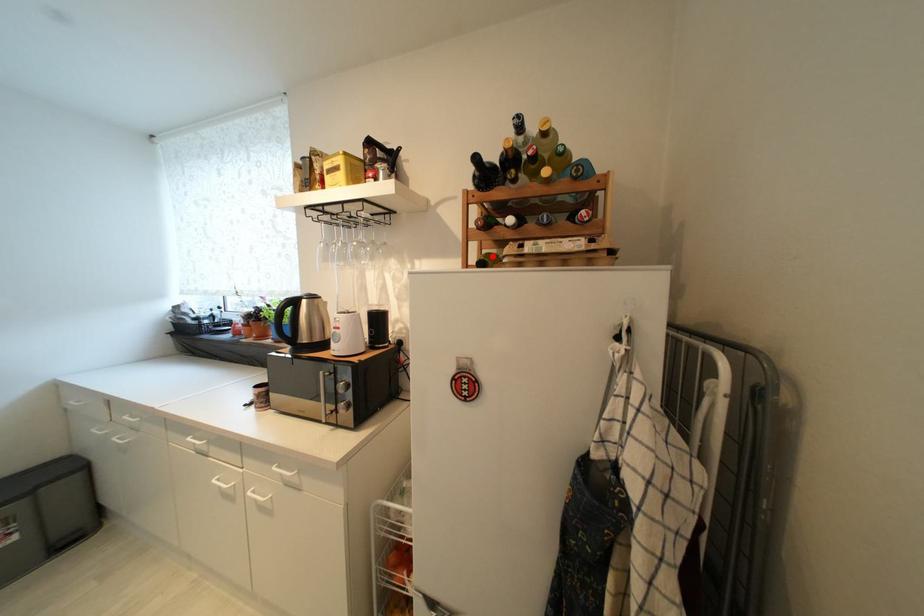
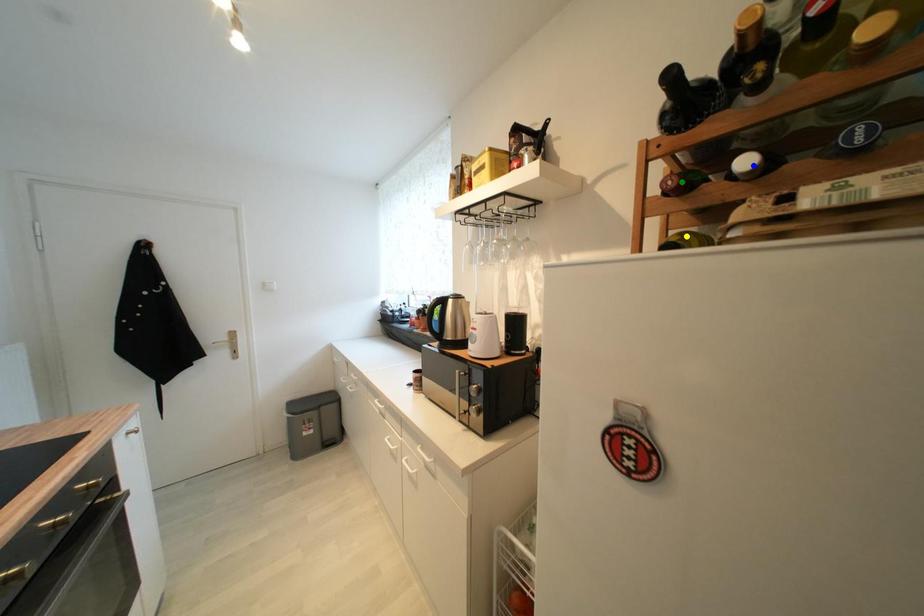
Question: I am providing you with two images of the same scene from different viewpoints. A red point is marked on the first image. You are given multiple points on the second image. Which spot in image 2 lines up with the point in image 1?

Choices:
 (A) green point
 (B) blue point
 (C) yellow point

Answer: (C)